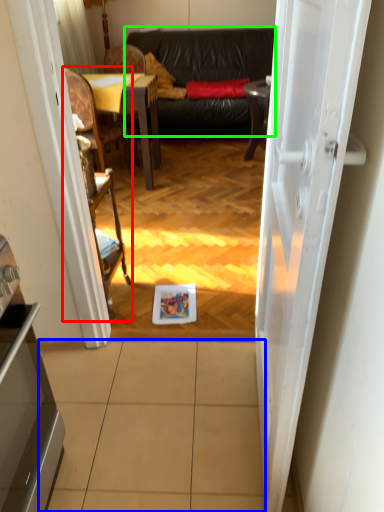
Question: Which object is positioned closest to armchair (highlighted by a red box)? Select from tile (highlighted by a blue box) and studio couch (highlighted by a green box).

Choices:
 (A) tile
 (B) studio couch

Answer: (A)